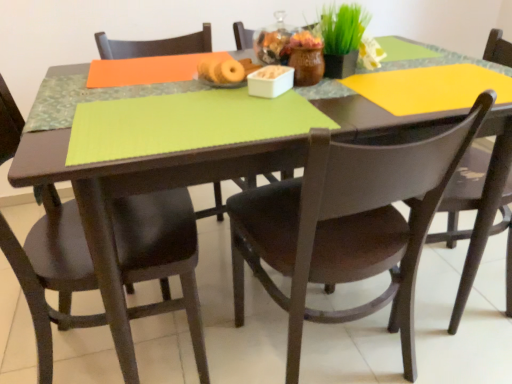
Question: Relative to green matte plant at upper center, is matte black chair at center, which is the 2th chair from left to right, in front or behind?

Choices:
 (A) behind
 (B) front

Answer: (B)

Question: Is matte black chair at center, which is the 2th chair from left to right, inside or outside of green matte plant at upper center?

Choices:
 (A) outside
 (B) inside

Answer: (A)

Question: Which object is the farthest from the matte black chair at right, positioned as the 3th chair in left-to-right order?

Choices:
 (A) matte black chair at center, positioned as the 2th chair in right-to-left order
 (B) matte black chair at left, which is the 3th chair in right-to-left order
 (C) green matte plant at upper center

Answer: (B)

Question: Which object is positioned closest to the green matte plant at upper center?

Choices:
 (A) matte black chair at left, the 1th chair in the left-to-right sequence
 (B) matte black chair at right, positioned as the 3th chair in left-to-right order
 (C) matte black chair at center, positioned as the 2th chair in right-to-left order

Answer: (C)